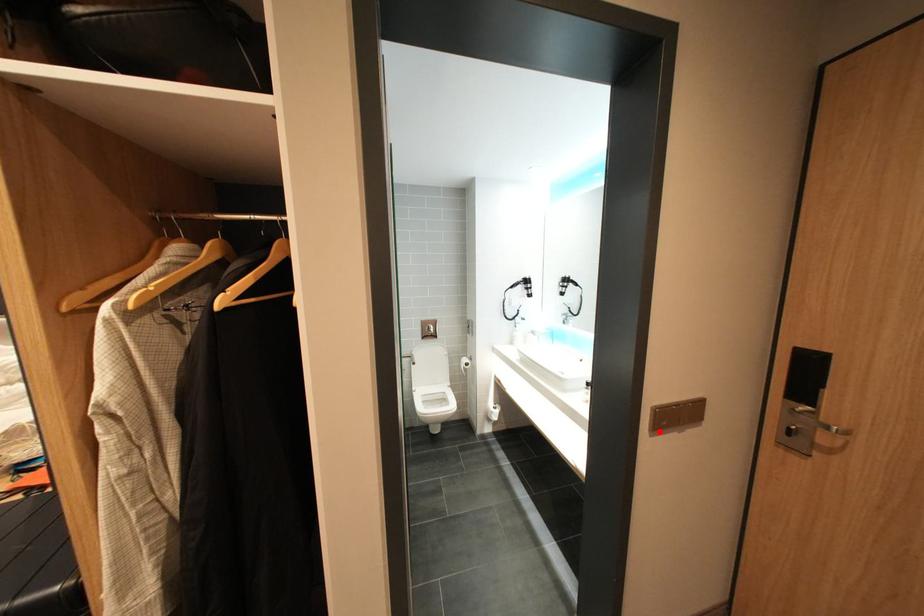
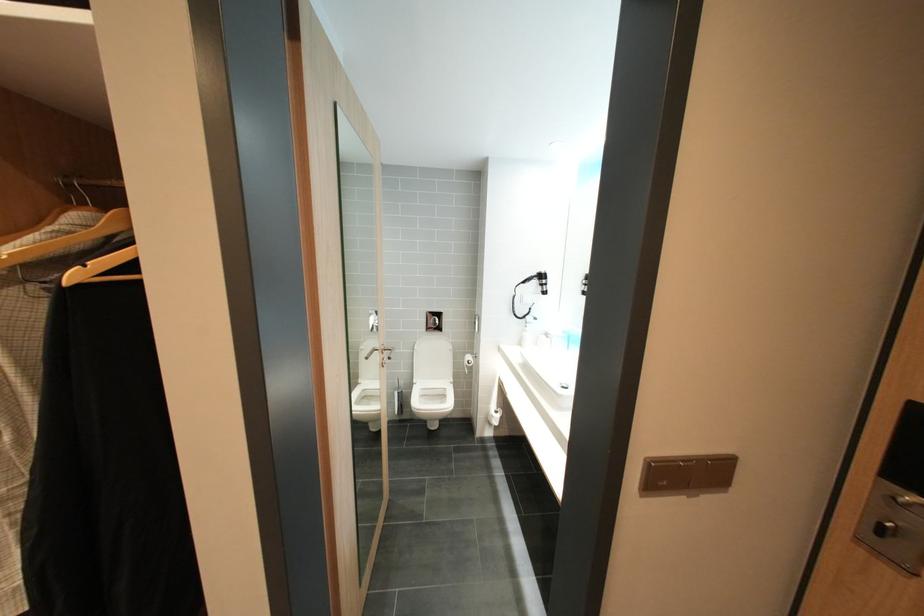
Locate, in the second image, the point that corresponds to the highlighted location in the first image.

(649, 491)